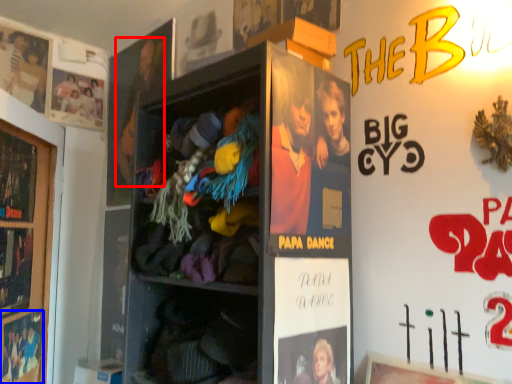
Question: Among these objects, which one is farthest to the camera, person (highlighted by a red box) or movie poster (highlighted by a blue box)?

Choices:
 (A) person
 (B) movie poster

Answer: (A)